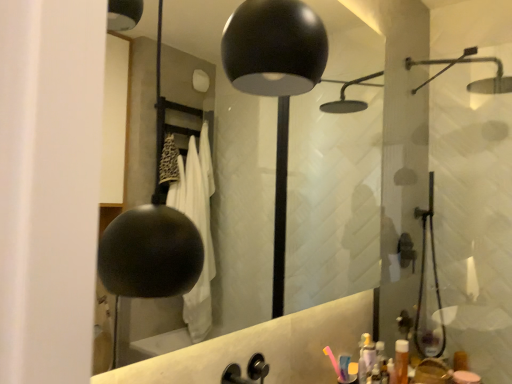
Question: Is pink plastic toothbrush at lower right surrounded by black matte faucet at center?

Choices:
 (A) no
 (B) yes

Answer: (A)

Question: Does black matte faucet at center lie in front of pink plastic toothbrush at lower right?

Choices:
 (A) yes
 (B) no

Answer: (A)

Question: Is black matte faucet at center outside pink plastic toothbrush at lower right?

Choices:
 (A) yes
 (B) no

Answer: (A)

Question: Considering the relative sizes of black matte faucet at center and pink plastic toothbrush at lower right in the image provided, is black matte faucet at center wider than pink plastic toothbrush at lower right?

Choices:
 (A) no
 (B) yes

Answer: (B)

Question: Is black matte faucet at center positioned with its back to pink plastic toothbrush at lower right?

Choices:
 (A) no
 (B) yes

Answer: (A)

Question: In terms of height, does black matte faucet at center look taller or shorter compared to translucent orange bottle at lower right?

Choices:
 (A) tall
 (B) short

Answer: (B)

Question: Which is correct: black matte faucet at center is inside translucent orange bottle at lower right, or outside of it?

Choices:
 (A) outside
 (B) inside

Answer: (A)

Question: From a real-world perspective, is black matte faucet at center above or below translucent orange bottle at lower right?

Choices:
 (A) above
 (B) below

Answer: (A)

Question: Is black matte faucet at center wider or thinner than translucent orange bottle at lower right?

Choices:
 (A) thin
 (B) wide

Answer: (B)

Question: In terms of height, does black matte faucet at center look taller or shorter compared to black matte mirror at upper center?

Choices:
 (A) short
 (B) tall

Answer: (A)

Question: Is black matte faucet at center wider or thinner than black matte mirror at upper center?

Choices:
 (A) wide
 (B) thin

Answer: (B)

Question: Based on their positions, is black matte faucet at center located to the left or right of black matte mirror at upper center?

Choices:
 (A) left
 (B) right

Answer: (B)

Question: Is black matte faucet at center inside the boundaries of black matte mirror at upper center, or outside?

Choices:
 (A) inside
 (B) outside

Answer: (B)

Question: From a real-world perspective, relative to pink plastic toothbrush at lower right, is black matte faucet at center vertically above or below?

Choices:
 (A) above
 (B) below

Answer: (A)

Question: Choose the correct answer: Is black matte faucet at center inside pink plastic toothbrush at lower right or outside it?

Choices:
 (A) outside
 (B) inside

Answer: (A)